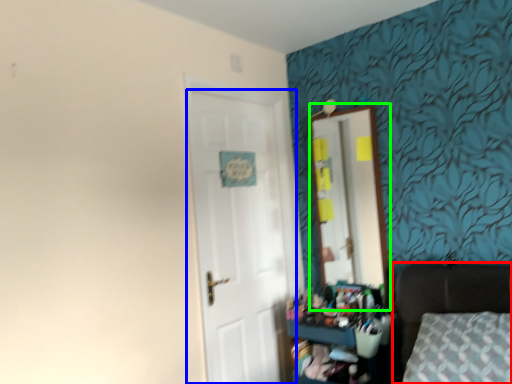
Question: Based on their relative distances, which object is farther from furniture (highlighted by a red box)? Choose from door (highlighted by a blue box) and mirror (highlighted by a green box).

Choices:
 (A) door
 (B) mirror

Answer: (A)